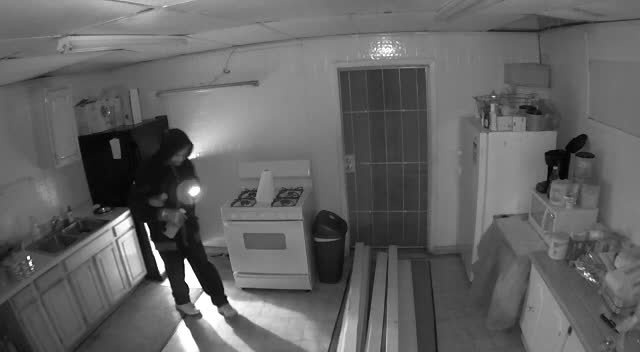
Find the location of `stove top`. stove top is located at coordinates (262, 204), (300, 203), (223, 204).